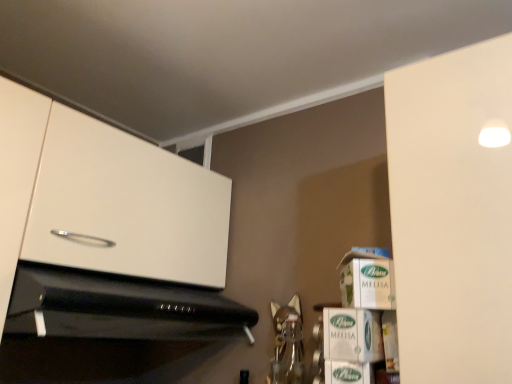
Where is `black glossy microwave at lower left`? black glossy microwave at lower left is located at coordinates (119, 307).

Measure the distance between white cardboard box at lower right and camera.

white cardboard box at lower right is 62.90 centimeters from camera.

Where is `white cardboard box at right, the third cardboard box positioned from the bottom`? white cardboard box at right, the third cardboard box positioned from the bottom is located at coordinates (367, 280).

What do you see at coordinates (352, 335) in the screenshot? Image resolution: width=512 pixels, height=384 pixels. I see `green cardboard box at lower right, the 2th cardboard box positioned from the top` at bounding box center [352, 335].

Locate an element on the screen. The image size is (512, 384). green cardboard box at lower right, arranged as the third cardboard box when viewed from the top is located at coordinates (348, 372).

Image resolution: width=512 pixels, height=384 pixels. I want to click on white glossy cabinet at upper left, so click(x=102, y=199).

Measure the distance between point (130,272) and camera.

They are 1.01 meters apart.

Where is `black glossy microwave at lower left`? This screenshot has width=512, height=384. black glossy microwave at lower left is located at coordinates point(119,307).

Can white glossy cabinet at upper left be found inside white cardboard box at right, which is the 1th cardboard box from top to bottom?

No, white glossy cabinet at upper left is not surrounded by white cardboard box at right, which is the 1th cardboard box from top to bottom.

From the image's perspective, which one is positioned lower, white cardboard box at right, the third cardboard box positioned from the bottom, or white glossy cabinet at upper left?

white glossy cabinet at upper left.

Can you confirm if white cardboard box at right, the third cardboard box positioned from the bottom, is shorter than white glossy cabinet at upper left?

Correct, white cardboard box at right, the third cardboard box positioned from the bottom, is not as tall as white glossy cabinet at upper left.

Considering the sizes of objects white cardboard box at right, the third cardboard box positioned from the bottom, and white glossy cabinet at upper left in the image provided, who is bigger, white cardboard box at right, the third cardboard box positioned from the bottom, or white glossy cabinet at upper left?

Bigger between the two is white glossy cabinet at upper left.

Is white glossy cabinet at upper left taller or shorter than white cardboard box at right, the third cardboard box positioned from the bottom?

white glossy cabinet at upper left is taller than white cardboard box at right, the third cardboard box positioned from the bottom.

Which object is further away from the camera, white glossy cabinet at upper left or white cardboard box at right, which is the 1th cardboard box from top to bottom?

white cardboard box at right, which is the 1th cardboard box from top to bottom, is behind.

From the image's perspective, would you say white glossy cabinet at upper left is shown under white cardboard box at right, the third cardboard box positioned from the bottom?

Yes.

From a real-world perspective, between white glossy cabinet at upper left and white cardboard box at right, the third cardboard box positioned from the bottom, who is vertically lower?

white cardboard box at right, the third cardboard box positioned from the bottom, is physically lower.

In the image, is black glossy microwave at lower left positioned in front of or behind white cardboard box at right, the third cardboard box positioned from the bottom?

Clearly, black glossy microwave at lower left is in front of white cardboard box at right, the third cardboard box positioned from the bottom.

In the scene shown: Considering the relative positions of black glossy microwave at lower left and white cardboard box at right, which is the 1th cardboard box from top to bottom, in the image provided, is black glossy microwave at lower left to the left or to the right of white cardboard box at right, which is the 1th cardboard box from top to bottom,?

Based on their positions, black glossy microwave at lower left is located to the left of white cardboard box at right, which is the 1th cardboard box from top to bottom.

Between black glossy microwave at lower left and white cardboard box at right, which is the 1th cardboard box from top to bottom, which one has larger size?

Bigger between the two is black glossy microwave at lower left.

How different are the orientations of white cardboard box at lower right and green cardboard box at lower right, the 2th cardboard box positioned from the top, in degrees?

3.13 degrees.

Consider the image. Could you tell me if white cardboard box at lower right is turned towards green cardboard box at lower right, the 2th cardboard box positioned from the top?

No, white cardboard box at lower right is not aimed at green cardboard box at lower right, the 2th cardboard box positioned from the top.

Considering the relative sizes of white cardboard box at lower right and green cardboard box at lower right, the 2th cardboard box positioned from the top, in the image provided, is white cardboard box at lower right taller than green cardboard box at lower right, the 2th cardboard box positioned from the top,?

Yes, white cardboard box at lower right is taller than green cardboard box at lower right, the 2th cardboard box positioned from the top.

Is point (371, 347) closer or farther from the camera than point (358, 299)?

Point (371, 347).

Is green cardboard box at lower right, positioned as the 2th cardboard box in bottom-to-top order, touching white cardboard box at right, the third cardboard box positioned from the bottom?

Yes, green cardboard box at lower right, positioned as the 2th cardboard box in bottom-to-top order, is with white cardboard box at right, the third cardboard box positioned from the bottom.

Between green cardboard box at lower right, positioned as the 2th cardboard box in bottom-to-top order, and white cardboard box at right, the third cardboard box positioned from the bottom, which one appears on the right side from the viewer's perspective?

white cardboard box at right, the third cardboard box positioned from the bottom, is more to the right.

Who is more distant, green cardboard box at lower right, the 2th cardboard box positioned from the top, or white cardboard box at right, which is the 1th cardboard box from top to bottom?

white cardboard box at right, which is the 1th cardboard box from top to bottom, is more distant.

Based on the photo, do you think white cardboard box at lower right is within white cardboard box at right, which is the 1th cardboard box from top to bottom, or outside of it?

white cardboard box at lower right exists outside the volume of white cardboard box at right, which is the 1th cardboard box from top to bottom.

Does white cardboard box at lower right have a smaller size compared to white cardboard box at right, the third cardboard box positioned from the bottom?

Actually, white cardboard box at lower right might be larger than white cardboard box at right, the third cardboard box positioned from the bottom.

How far apart are white cardboard box at lower right and white cardboard box at right, which is the 1th cardboard box from top to bottom?

A distance of 2.43 inches exists between white cardboard box at lower right and white cardboard box at right, which is the 1th cardboard box from top to bottom.

Which is closer to the camera, (330, 344) or (372, 304)?

Point (330, 344) is positioned closer to the camera compared to point (372, 304).

From a real-world perspective, is green cardboard box at lower right, the 2th cardboard box positioned from the top, positioned over white glossy cabinet at upper left based on gravity?

Incorrect, from a real-world perspective, green cardboard box at lower right, the 2th cardboard box positioned from the top, is lower than white glossy cabinet at upper left.

Looking at this image, from the image's perspective, relative to white glossy cabinet at upper left, is green cardboard box at lower right, the 2th cardboard box positioned from the top, above or below?

Clearly, from the image's perspective, green cardboard box at lower right, the 2th cardboard box positioned from the top, is below white glossy cabinet at upper left.

At what (x,y) coordinates should I click in order to perform the action: click on cabinetry above the green cardboard box at lower right, positioned as the 2th cardboard box in bottom-to-top order (from the image's perspective). Please return your answer as a coordinate pair (x, y). The width and height of the screenshot is (512, 384). Looking at the image, I should click on (102, 199).

At what (x,y) coordinates should I click in order to perform the action: click on cardboard box that is the 1st object directly below the white glossy cabinet at upper left (from a real-world perspective). Please return your answer as a coordinate pair (x, y). Looking at the image, I should click on (367, 280).

Find the location of a particular element. This screenshot has height=384, width=512. cardboard box above the white glossy cabinet at upper left (from the image's perspective) is located at coordinates (367, 280).

Based on their spatial positions, is black glossy microwave at lower left or green cardboard box at lower right, marked as the 1th cardboard box in a bottom-to-top arrangement, further from green cardboard box at lower right, positioned as the 2th cardboard box in bottom-to-top order?

Among the two, black glossy microwave at lower left is located further to green cardboard box at lower right, positioned as the 2th cardboard box in bottom-to-top order.

When comparing their distances from black glossy microwave at lower left, does green cardboard box at lower right, positioned as the 2th cardboard box in bottom-to-top order, or white cardboard box at right, which is the 1th cardboard box from top to bottom, seem closer?

green cardboard box at lower right, positioned as the 2th cardboard box in bottom-to-top order.

Looking at the image, which one is located further to green cardboard box at lower right, the 2th cardboard box positioned from the top, white cardboard box at right, which is the 1th cardboard box from top to bottom, or black glossy microwave at lower left?

Based on the image, black glossy microwave at lower left appears to be further to green cardboard box at lower right, the 2th cardboard box positioned from the top.

From the image, which object appears to be nearer to black glossy microwave at lower left, white glossy cabinet at upper left or green cardboard box at lower right, arranged as the third cardboard box when viewed from the top?

Based on the image, white glossy cabinet at upper left appears to be nearer to black glossy microwave at lower left.

Which object lies further to the anchor point white cardboard box at right, which is the 1th cardboard box from top to bottom, green cardboard box at lower right, the 2th cardboard box positioned from the top, or black glossy microwave at lower left?

black glossy microwave at lower left lies further to white cardboard box at right, which is the 1th cardboard box from top to bottom, than the other object.

Consider the image. Considering their positions, is white cardboard box at lower right positioned closer to green cardboard box at lower right, positioned as the 2th cardboard box in bottom-to-top order, than white cardboard box at right, which is the 1th cardboard box from top to bottom?

white cardboard box at lower right.

From the picture: Considering their positions, is green cardboard box at lower right, arranged as the third cardboard box when viewed from the top, positioned further to white glossy cabinet at upper left than white cardboard box at right, the third cardboard box positioned from the bottom?

Among the two, green cardboard box at lower right, arranged as the third cardboard box when viewed from the top, is located further to white glossy cabinet at upper left.

Looking at the image, which one is located closer to white cardboard box at right, which is the 1th cardboard box from top to bottom, white glossy cabinet at upper left or black glossy microwave at lower left?

Based on the image, black glossy microwave at lower left appears to be nearer to white cardboard box at right, which is the 1th cardboard box from top to bottom.

You are a GUI agent. You are given a task and a screenshot of the screen. Output one action in this format:
    pyautogui.click(x=<x>, y=<y>)
    Task: Click on the cardboard box that lies between green cardboard box at lower right, positioned as the 2th cardboard box in bottom-to-top order, and white cardboard box at lower right from top to bottom
    
    Given the screenshot: What is the action you would take?
    pyautogui.click(x=348, y=372)

At what (x,y) coordinates should I click in order to perform the action: click on cardboard box located between black glossy microwave at lower left and green cardboard box at lower right, the 2th cardboard box positioned from the top, in the left-right direction. Please return your answer as a coordinate pair (x, y). Looking at the image, I should click on (348, 372).

At what (x,y) coordinates should I click in order to perform the action: click on shelf between black glossy microwave at lower left and green cardboard box at lower right, positioned as the 2th cardboard box in bottom-to-top order, in the horizontal direction. Please return your answer as a coordinate pair (x, y). Looking at the image, I should click on (354, 345).

At what (x,y) coordinates should I click in order to perform the action: click on shelf between black glossy microwave at lower left and white cardboard box at right, the third cardboard box positioned from the bottom, from left to right. Please return your answer as a coordinate pair (x, y). The height and width of the screenshot is (384, 512). Looking at the image, I should click on (354, 345).